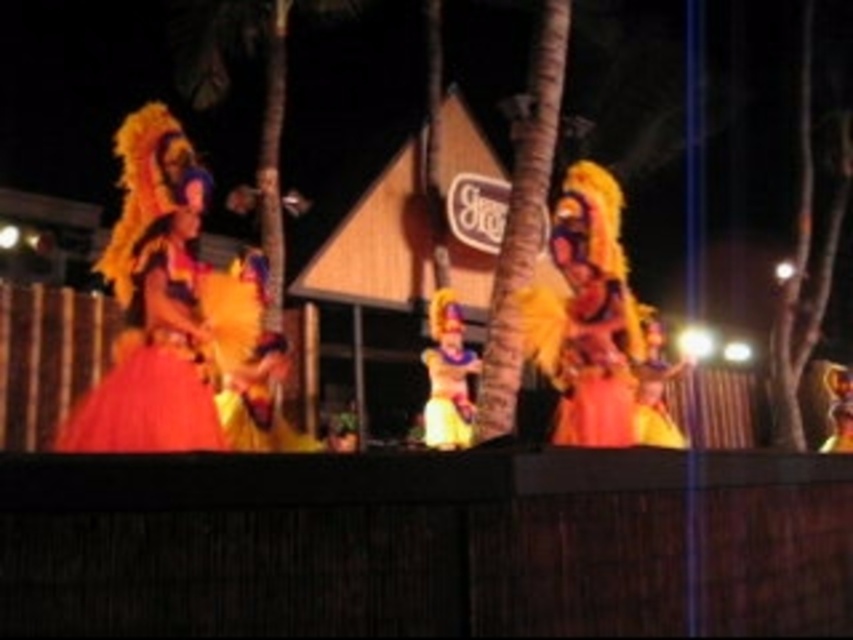
You are a photographer trying to capture a photo of the shiny orange costume at center and the shiny gold costume at center. Based on their widths, which costume should you focus on to ensure it fits entirely within your camera frame if the frame can only accommodate the narrower of the two?

The shiny gold costume at center is narrower than the shiny orange costume at center, so focusing on the shiny gold costume at center ensures it fits within the camera frame.